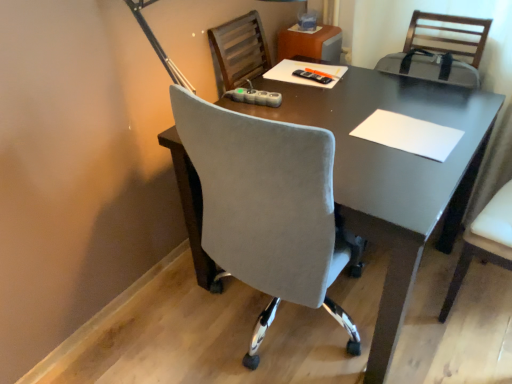
The height and width of the screenshot is (384, 512). I want to click on free space on the front side of white paper at center, so click(x=404, y=175).